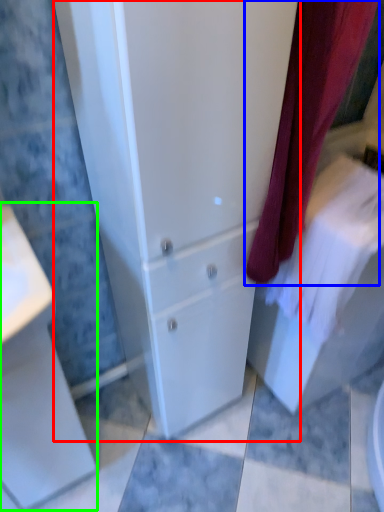
Question: Based on their relative distances, which object is nearer to bathroom cabinet (highlighted by a red box)? Choose from curtain (highlighted by a blue box) and porcelain (highlighted by a green box).

Choices:
 (A) curtain
 (B) porcelain

Answer: (A)